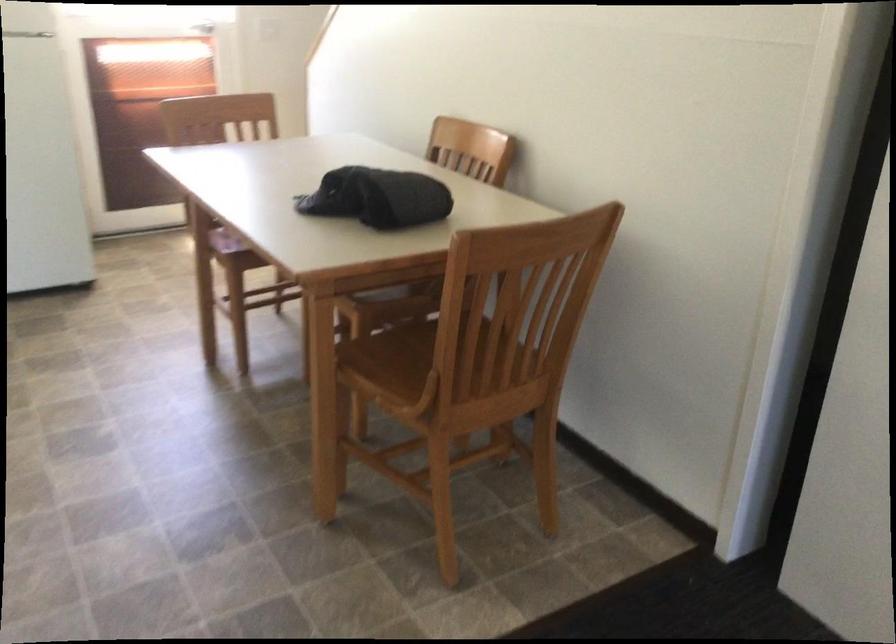
The image size is (896, 644). What do you see at coordinates (203, 28) in the screenshot? I see `the door handle` at bounding box center [203, 28].